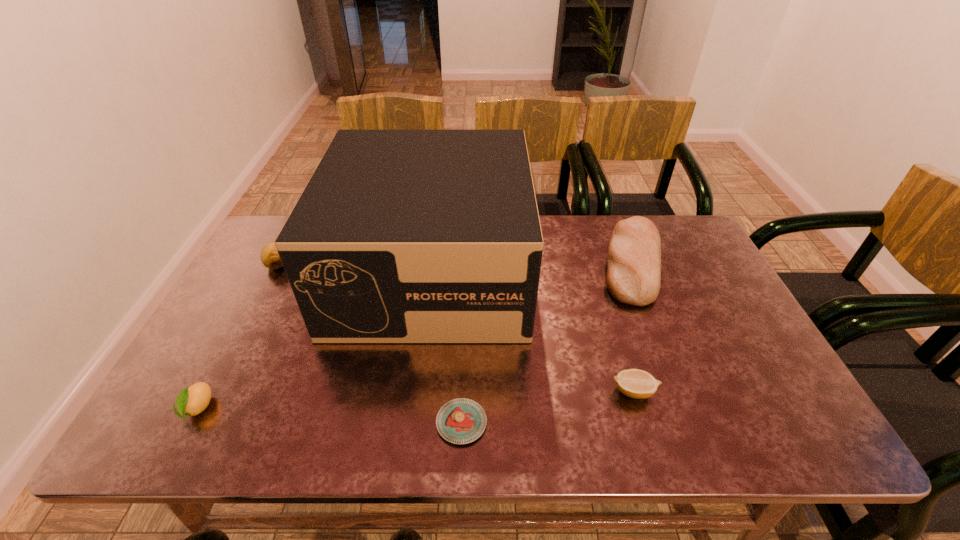
Find the location of `vacant space that satisfies the following two spatial constraints: 1. on the back side of the rightmost lemon; 2. on the right side of the pastry`. vacant space that satisfies the following two spatial constraints: 1. on the back side of the rightmost lemon; 2. on the right side of the pastry is located at coordinates (463, 392).